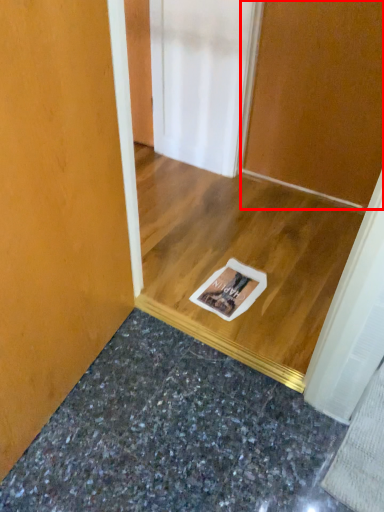
Question: Where is door (annotated by the red box) located in relation to granite in the image?

Choices:
 (A) left
 (B) right

Answer: (B)